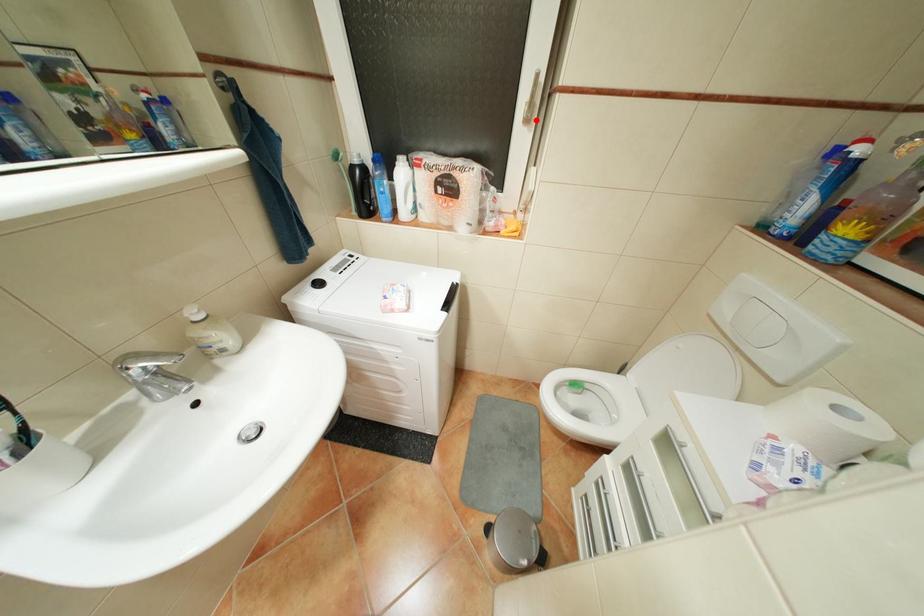
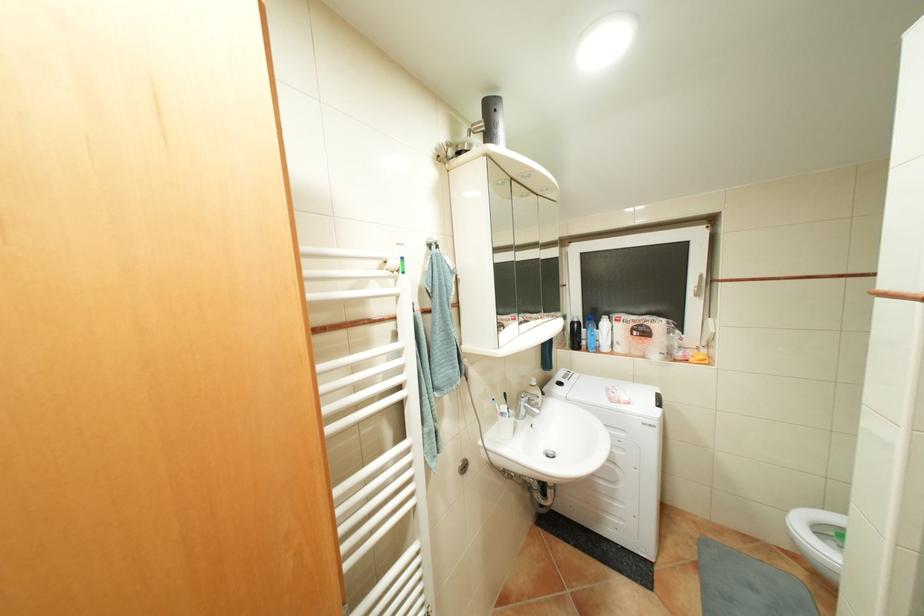
In the second image, find the point that corresponds to the highlighted location in the first image.

(707, 294)